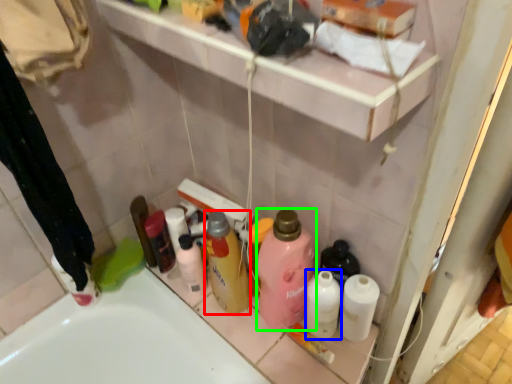
Question: Estimate the real-world distances between objects in this image. Which object is closer to cleaning product (highlighted by a red box), toiletry (highlighted by a blue box) or cleaning product (highlighted by a green box)?

Choices:
 (A) toiletry
 (B) cleaning product

Answer: (B)